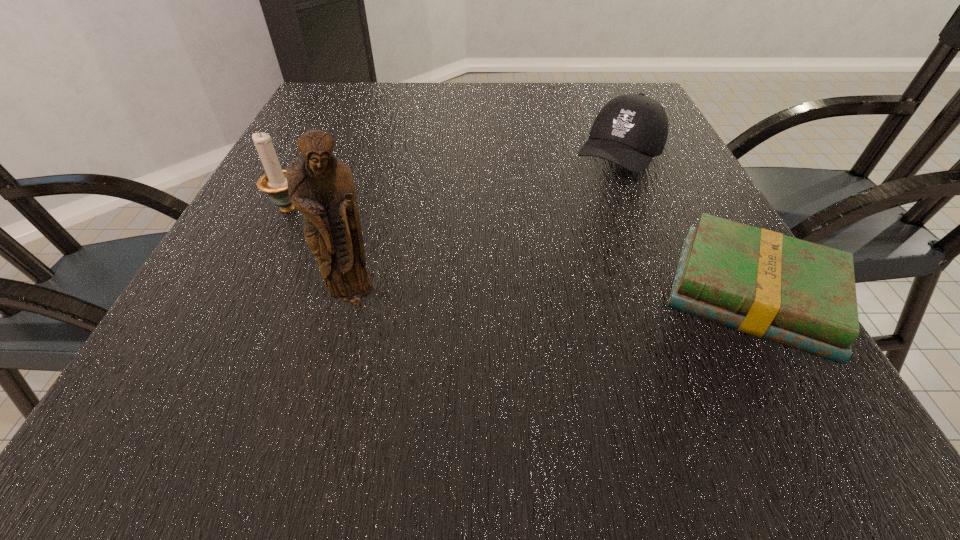
Locate an element on the screen. the tallest object is located at coordinates (321, 186).

Where is `figurine`? Image resolution: width=960 pixels, height=540 pixels. figurine is located at coordinates (321, 186).

I want to click on the shortest object, so click(800, 294).

This screenshot has height=540, width=960. I want to click on the second farthest object, so click(x=274, y=183).

Where is `the third shortest object`? Image resolution: width=960 pixels, height=540 pixels. the third shortest object is located at coordinates (274, 183).

The image size is (960, 540). Find the location of `the third tallest object`. the third tallest object is located at coordinates (630, 130).

Image resolution: width=960 pixels, height=540 pixels. I want to click on baseball cap, so click(x=630, y=130).

Identify the location of vacant space situated 0.070m on the front-facing side of the third object from right to left. The height and width of the screenshot is (540, 960). (343, 348).

Image resolution: width=960 pixels, height=540 pixels. Identify the location of free region located on the left of the book. (429, 294).

You are a GUI agent. You are given a task and a screenshot of the screen. Output one action in this format:
    pyautogui.click(x=<x>, y=<y>)
    Task: Click on the vacant area located on the handle side of the candle_holder
    The width and height of the screenshot is (960, 540).
    Given the screenshot: What is the action you would take?
    pyautogui.click(x=468, y=282)